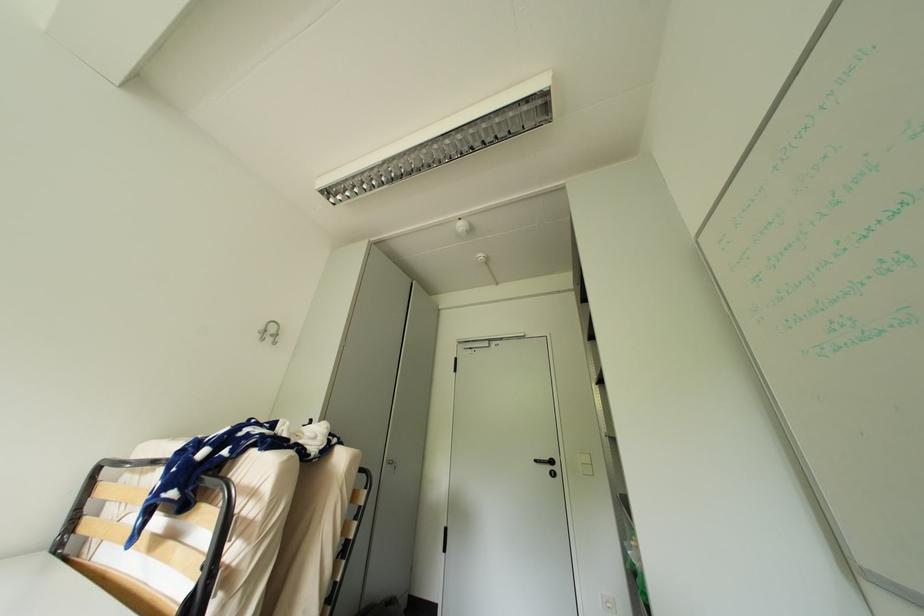
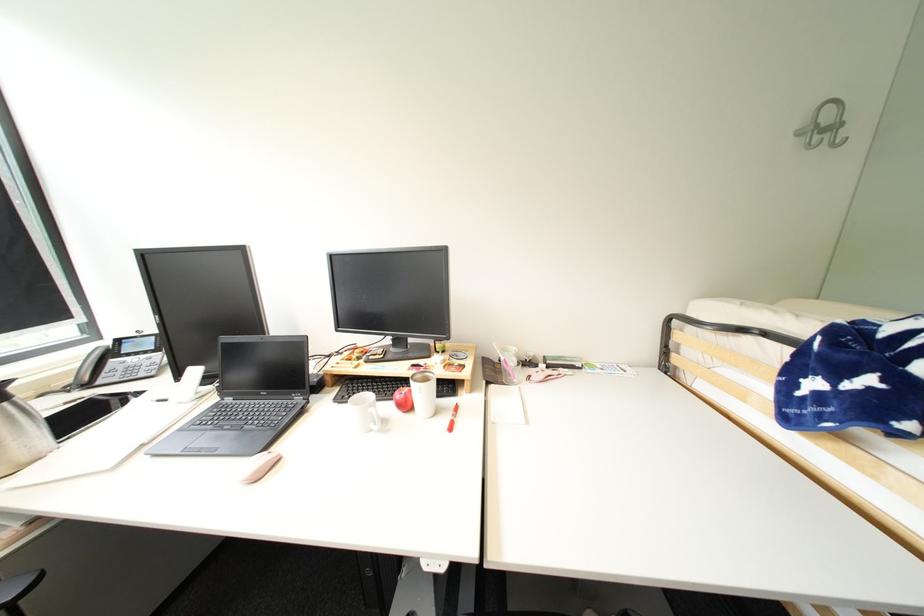
The images are taken continuously from a first-person perspective. In which direction is your viewpoint rotating?

The camera's rotation is toward left-down.